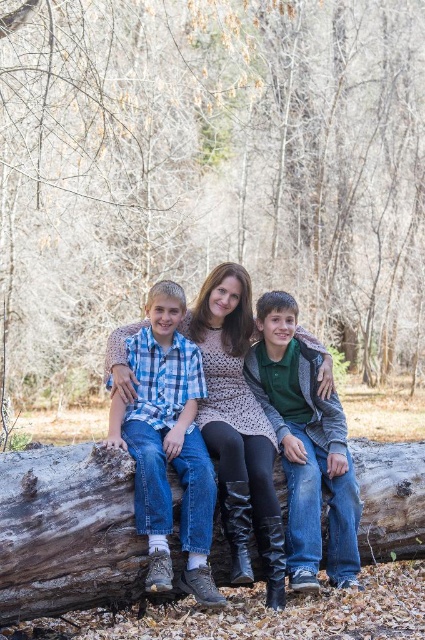
You are a photographer planning to take a family portrait using the same log as a prop. The log has a certain width. If you want to ensure the knit sweater at center and the brown rough tree trunk at center are both visible in the frame, which object should you position closer to the camera to avoid cropping?

The knit sweater at center is wider than the brown rough tree trunk at center. To ensure both are visible, position the knit sweater at center closer to the camera since its greater width will require more space in the frame.

You are a photographer trying to capture the family in the image. Since you want to focus on the brown rough tree trunk at center and the green cotton shirt at center, which one should you zoom in on to ensure it takes up more of the frame?

The green cotton shirt at center occupies more space than the brown rough tree trunk at center, so you should zoom in on the green cotton shirt at center to ensure it takes up more of the frame.

Consider the image. You are standing in front of the family sitting on the log in the forest. There are two points marked in the image. Which point, point (124, 524) or point (283, 344), is closer to you?

Point (124, 524) is closer to you than point (283, 344).